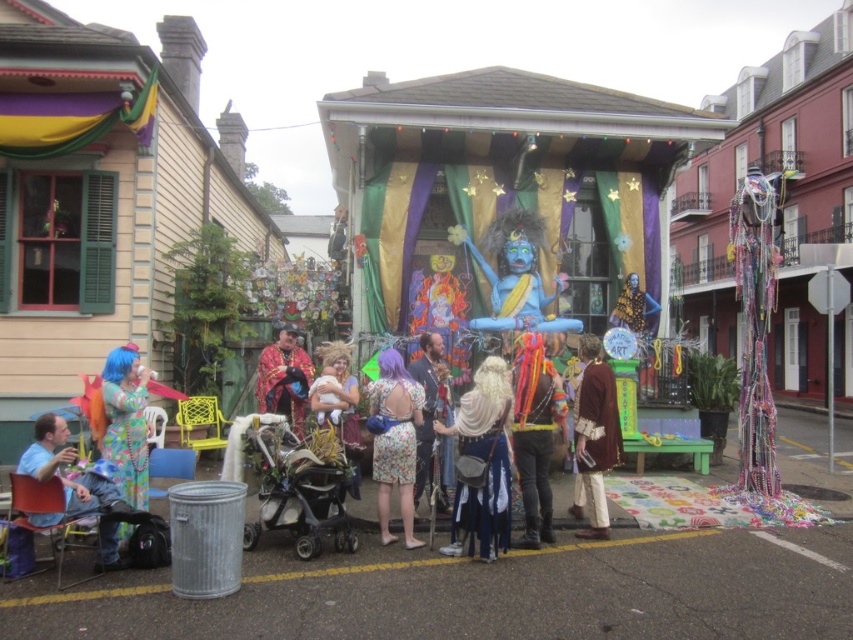
You are attending a Mardi Gras parade and need to sit down. There is a light blue fabric chair at lower left and a fluorescent blue wig at lower left. Which object should you approach first to sit?

The light blue fabric chair at lower left is to the left of the fluorescent blue wig at lower left, so you should approach the light blue fabric chair at lower left first to sit.

You are standing in the middle of the street during the Mardi Gras celebration and see two points marked in the scene. Which point, point [71,452] or point [115,426], is closer to you?

Point [71,452] is closer to the viewer than point [115,426].